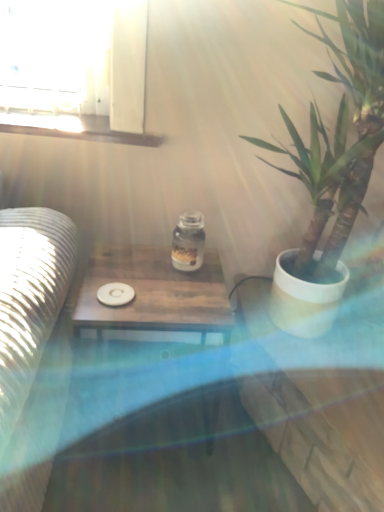
This screenshot has width=384, height=512. I want to click on empty space that is in between transparent glass jar at center and white matte coaster at center, so click(x=147, y=280).